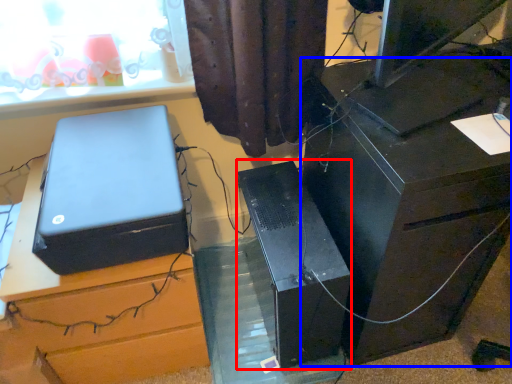
Question: Among these objects, which one is nearest to the camera, computer tower (highlighted by a red box) or furniture (highlighted by a blue box)?

Choices:
 (A) computer tower
 (B) furniture

Answer: (B)